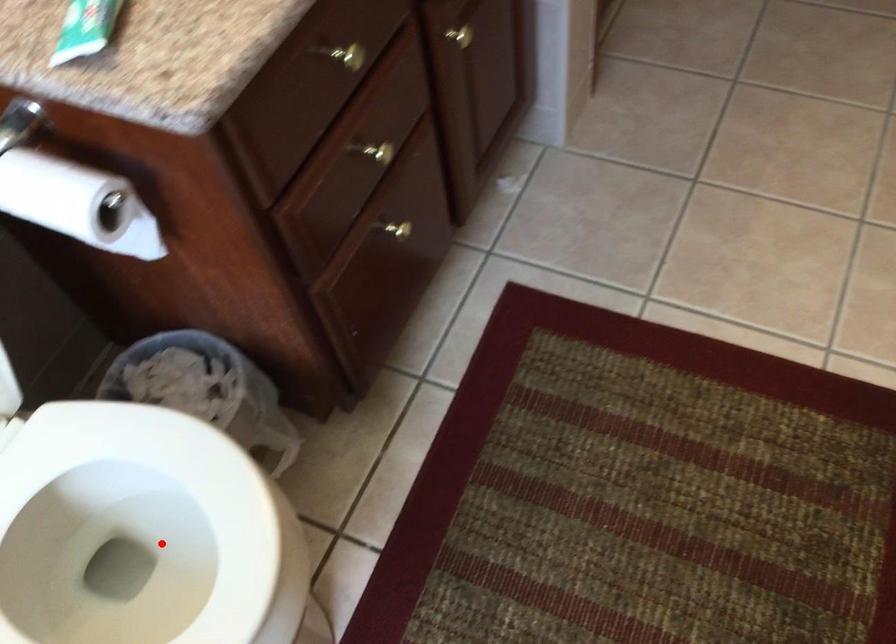
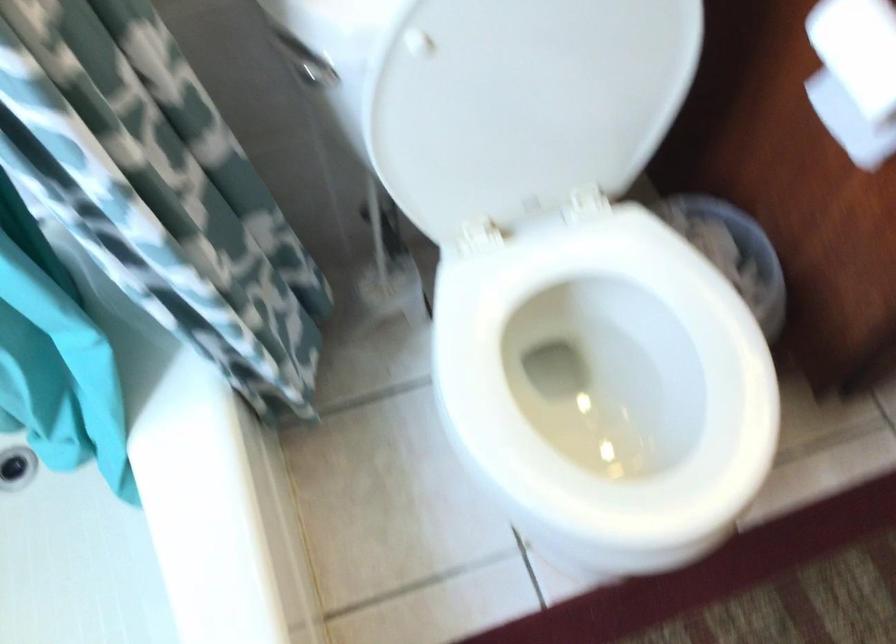
Locate, in the second image, the point that corresponds to the highlighted location in the first image.

(606, 375)